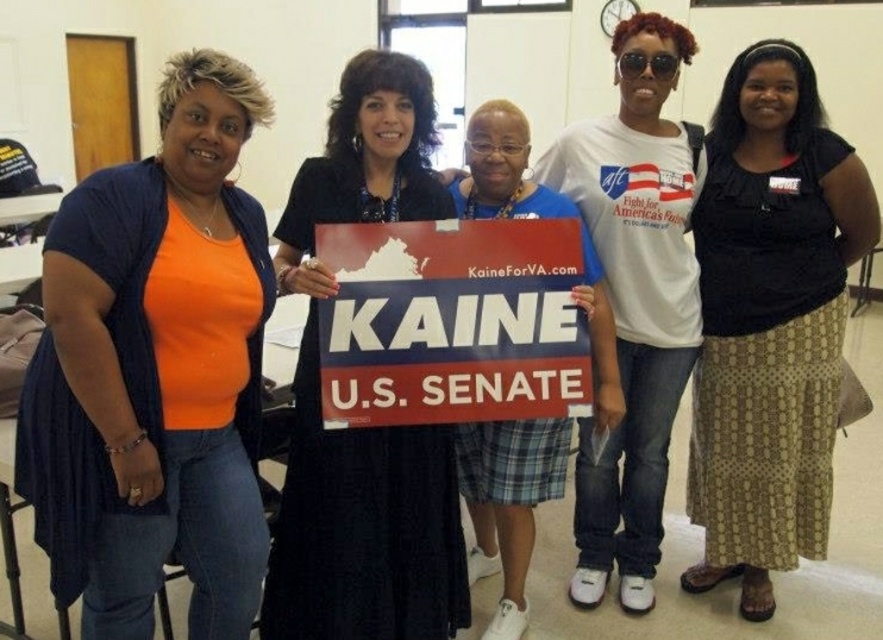
Question: Which object is the closest to the blue plaid skirt at center?

Choices:
 (A) matte plastic sign at center
 (B) black fabric sign at center

Answer: (B)

Question: Is orange matte shirt at left smaller than black textured skirt at center?

Choices:
 (A) yes
 (B) no

Answer: (A)

Question: Estimate the real-world distances between objects in this image. Which object is closer to the matte plastic sign at center?

Choices:
 (A) black fabric sign at center
 (B) black textured skirt at center
 (C) orange matte shirt at left

Answer: (A)

Question: Which object is positioned farthest from the blue plaid skirt at center?

Choices:
 (A) matte plastic sign at center
 (B) orange matte shirt at left

Answer: (B)

Question: Does black fabric sign at center have a smaller size compared to blue plaid skirt at center?

Choices:
 (A) no
 (B) yes

Answer: (B)

Question: Considering the relative positions of black textured skirt at center and black fabric sign at center in the image provided, where is black textured skirt at center located with respect to black fabric sign at center?

Choices:
 (A) left
 (B) right

Answer: (B)